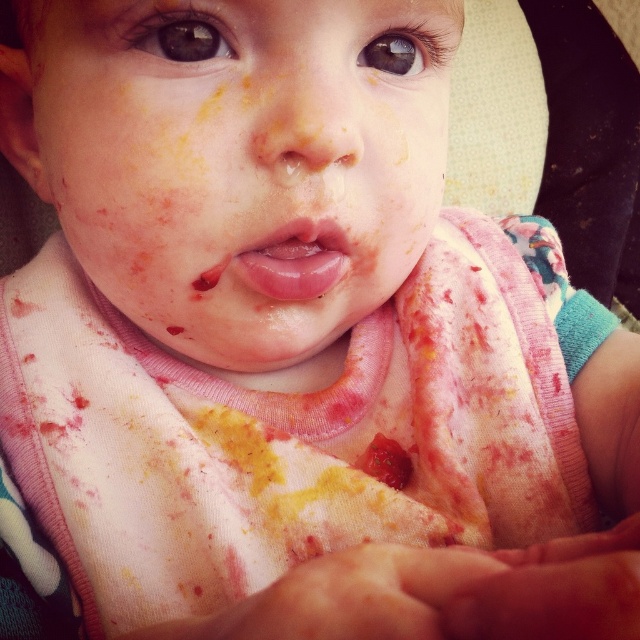
The baby is wearing a matte pink bib at center and has glossy pink lips at center. Which object is taller?

The matte pink bib at center is taller than the glossy pink lips at center.

You are a parent trying to wipe your baby clean. You have a clean cloth that is 6 centimeters wide. Can you reach from the matte pink bib at center to the glossy pink lips at center with one swipe of the cloth?

The distance between the matte pink bib at center and the glossy pink lips at center is 5.91 centimeters. Since the cloth is 6 centimeters wide, it can cover the distance in one swipe.